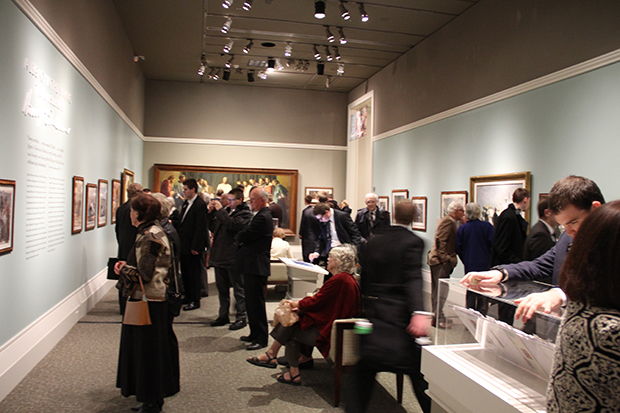
This screenshot has width=620, height=413. I want to click on large painting on back wall, so click(x=209, y=178), click(x=289, y=178).